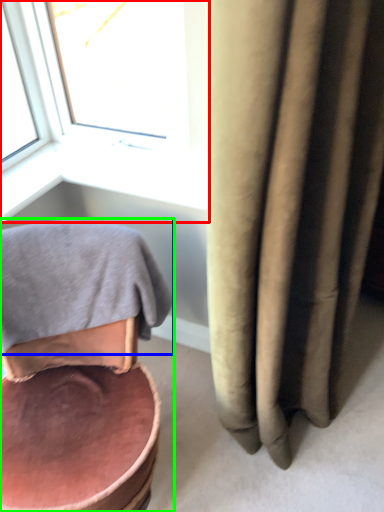
Question: Estimate the real-world distances between objects in this image. Which object is closer to window (highlighted by a red box), bath towel (highlighted by a blue box) or chair (highlighted by a green box)?

Choices:
 (A) bath towel
 (B) chair

Answer: (A)